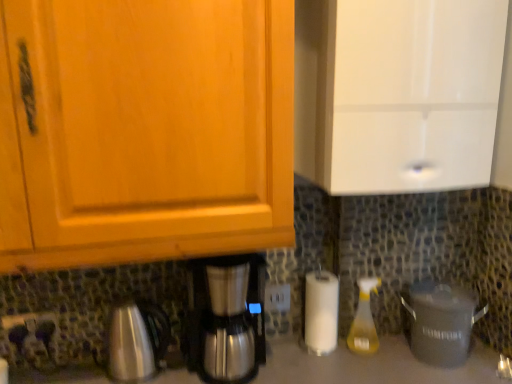
Question: Considering the relative sizes of yellow translucent spray bottle at lower right and gray matte crock pot at lower right in the image provided, is yellow translucent spray bottle at lower right thinner than gray matte crock pot at lower right?

Choices:
 (A) yes
 (B) no

Answer: (A)

Question: From a real-world perspective, is yellow translucent spray bottle at lower right physically above gray matte crock pot at lower right?

Choices:
 (A) yes
 (B) no

Answer: (A)

Question: Would you say yellow translucent spray bottle at lower right is a long distance from gray matte crock pot at lower right?

Choices:
 (A) no
 (B) yes

Answer: (A)

Question: Does yellow translucent spray bottle at lower right contain gray matte crock pot at lower right?

Choices:
 (A) yes
 (B) no

Answer: (B)

Question: Is yellow translucent spray bottle at lower right oriented away from gray matte crock pot at lower right?

Choices:
 (A) yes
 (B) no

Answer: (B)

Question: Considering the relative sizes of yellow translucent spray bottle at lower right and gray matte crock pot at lower right in the image provided, is yellow translucent spray bottle at lower right wider than gray matte crock pot at lower right?

Choices:
 (A) yes
 (B) no

Answer: (B)

Question: From the image's perspective, does metallic silver power plugs and sockets at lower left, the 1th power plugs and sockets in the front-to-back sequence, appear higher than matte black outlet at lower center?

Choices:
 (A) no
 (B) yes

Answer: (B)

Question: From a real-world perspective, is metallic silver power plugs and sockets at lower left, the 1th power plugs and sockets positioned from the left, over matte black outlet at lower center?

Choices:
 (A) yes
 (B) no

Answer: (A)

Question: Is metallic silver power plugs and sockets at lower left, marked as the second power plugs and sockets in a back-to-front arrangement, facing away from matte black outlet at lower center?

Choices:
 (A) yes
 (B) no

Answer: (A)

Question: Is metallic silver power plugs and sockets at lower left, marked as the second power plugs and sockets in a back-to-front arrangement, shorter than matte black outlet at lower center?

Choices:
 (A) no
 (B) yes

Answer: (A)

Question: Can you confirm if metallic silver power plugs and sockets at lower left, the 2th power plugs and sockets viewed from the right, is taller than matte black outlet at lower center?

Choices:
 (A) yes
 (B) no

Answer: (A)

Question: Is metallic silver power plugs and sockets at lower left, the 2th power plugs and sockets viewed from the right, beside matte black outlet at lower center?

Choices:
 (A) no
 (B) yes

Answer: (B)

Question: Is white plastic power plugs and sockets at center, which ranks as the 2th power plugs and sockets in front-to-back order, completely or partially outside of gray matte crock pot at lower right?

Choices:
 (A) no
 (B) yes

Answer: (B)